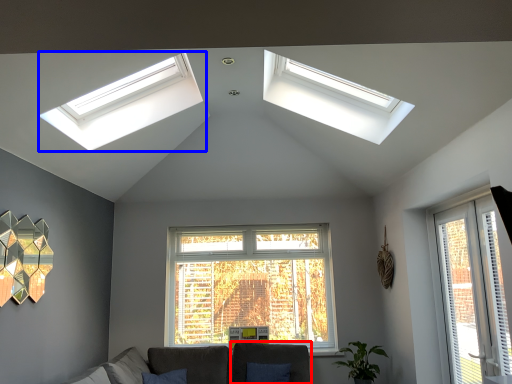
Question: Which of the following is the closest to the observer, armchair (highlighted by a red box) or window (highlighted by a blue box)?

Choices:
 (A) armchair
 (B) window

Answer: (B)